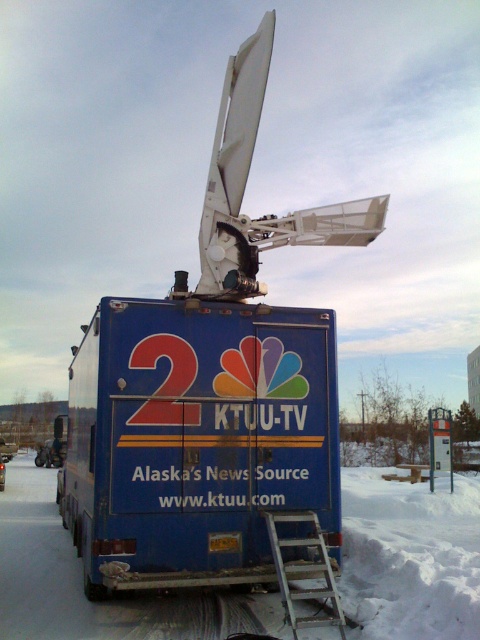
In the scene shown: You are a delivery person trying to park your truck next to the blue matte truck at center and the silver metallic ladder at lower center. Since the parking space is narrow, you need to know which object takes up more horizontal space. Which one is wider?

The blue matte truck at center has a lesser width compared to the silver metallic ladder at lower center, so the silver metallic ladder at lower center is wider and takes up more horizontal space.

You are a delivery person trying to reach the blue matte truck at center. There is a silver metallic ladder at lower center in your way. Can you walk around the ladder to get to the truck?

The blue matte truck at center is further to the viewer than the silver metallic ladder at lower center, so the truck is closer to you. Therefore, you can walk around the ladder to reach the truck.